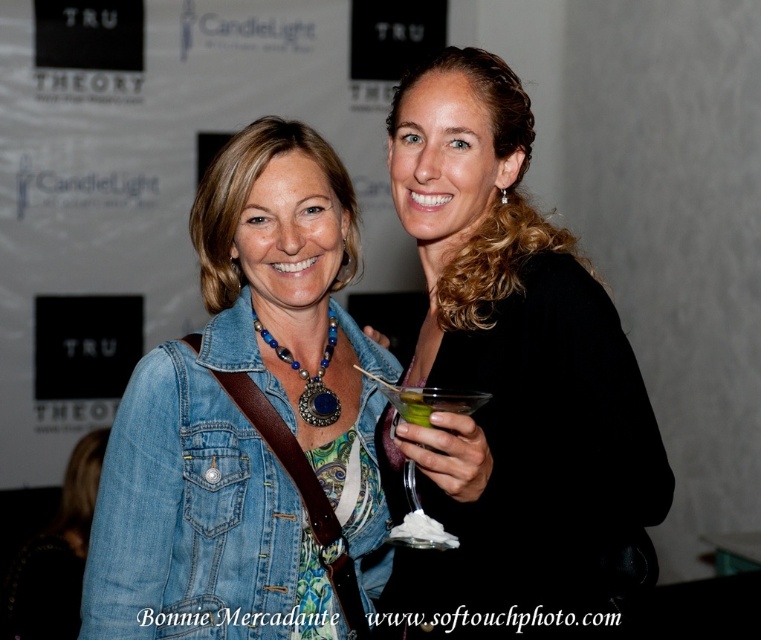
Is denim jacket at lower right below green translucent glass at center?

Yes.

Which is below, denim jacket at lower right or green translucent glass at center?

Positioned lower is denim jacket at lower right.

The image size is (761, 640). Identify the location of denim jacket at lower right. (201, 508).

In the scene shown: Measure the distance between black matte dress at right and camera.

black matte dress at right is 4.28 feet from camera.

Can you confirm if black matte dress at right is thinner than green translucent glass at center?

Incorrect, black matte dress at right's width is not less than green translucent glass at center's.

The width and height of the screenshot is (761, 640). Describe the element at coordinates (510, 385) in the screenshot. I see `black matte dress at right` at that location.

You are a GUI agent. You are given a task and a screenshot of the screen. Output one action in this format:
    pyautogui.click(x=<x>, y=<y>)
    Task: Click on the black matte dress at right
    
    Given the screenshot: What is the action you would take?
    pyautogui.click(x=510, y=385)

Which is more to the left, black matte dress at right or denim jacket at lower right?

denim jacket at lower right

Is the position of black matte dress at right less distant than that of denim jacket at lower right?

Yes, black matte dress at right is closer to the viewer.

Between point (588, 600) and point (244, 440), which one is positioned in front?

Positioned in front is point (588, 600).

You are a GUI agent. You are given a task and a screenshot of the screen. Output one action in this format:
    pyautogui.click(x=<x>, y=<y>)
    Task: Click on the black matte dress at right
    
    Given the screenshot: What is the action you would take?
    pyautogui.click(x=510, y=385)